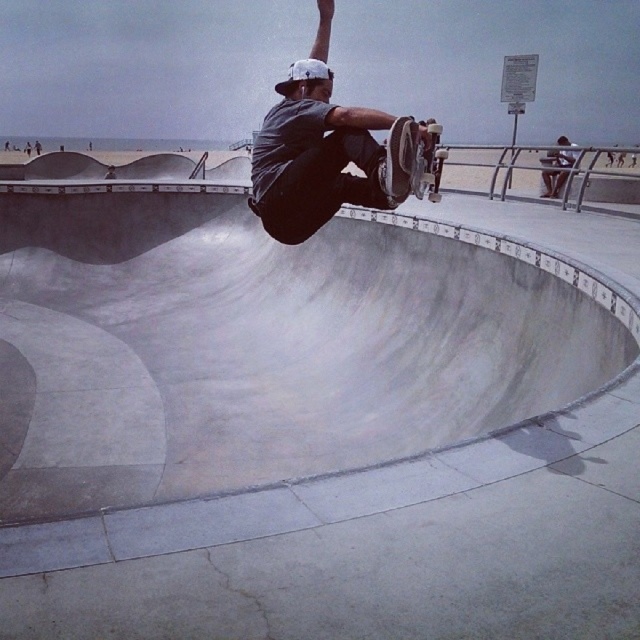
You are a drone operator trying to capture the skateboarder midair. You have two points marked in the bowl where the skateboarder might land. The first point is at coordinates point (348, 179) and the second is at point (422, 168). Which point is closer to the camera?

Point (422, 168) is closer to the camera since point (348, 179) is behind it.

You are a photographer at the skatepark and want to capture the skateboarder midair. Based on the scene, which object is positioned higher in the frame between the matte gray shirt at center and the wooden deck skateboard at center?

The matte gray shirt at center is above the wooden deck skateboard at center, so it is positioned higher in the frame.

In the scene shown: A drone is flying at a height of 4 meters above the ground. It needs to capture a photo of the skateboarder and the point marked at coordinates point (x=298, y=80). Will the drone be able to include both in the photo if the camera has a 120 degree field of view?

The skateboarder and the point marked at coordinates point (x=298, y=80) are 3.75 meters apart. Since the drone is flying at 4 meters height, the horizontal distance between them is less than the drone height, so the 120 degree field of view should be sufficient to capture both in the photo.